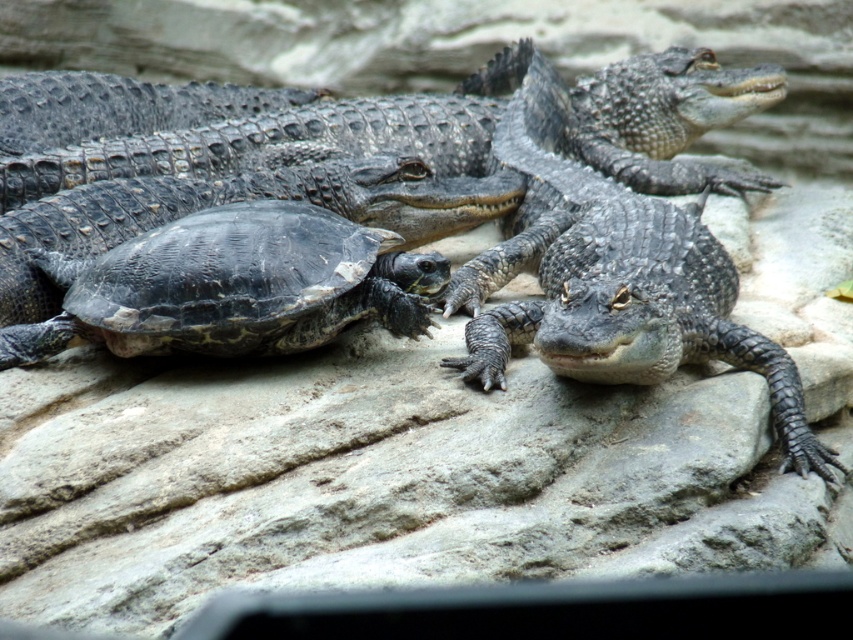
Can you confirm if shiny black alligator at center is taller than black textured shell at lower left?

Yes.

This screenshot has width=853, height=640. What do you see at coordinates (613, 284) in the screenshot? I see `shiny black alligator at center` at bounding box center [613, 284].

At what (x,y) coordinates should I click in order to perform the action: click on shiny black alligator at center. Please return your answer as a coordinate pair (x, y). This screenshot has height=640, width=853. Looking at the image, I should click on (613, 284).

Where is `shiny black alligator at center`? shiny black alligator at center is located at coordinates (613, 284).

Is shiny dark green crocodile at center above shiny black alligator at center?

Correct, shiny dark green crocodile at center is located above shiny black alligator at center.

Does shiny dark green crocodile at center have a larger size compared to shiny black alligator at center?

Correct, shiny dark green crocodile at center is larger in size than shiny black alligator at center.

I want to click on shiny dark green crocodile at center, so click(351, 150).

The image size is (853, 640). I want to click on shiny dark green crocodile at center, so click(351, 150).

Is shiny dark green crocodile at center thinner than black textured shell at lower left?

In fact, shiny dark green crocodile at center might be wider than black textured shell at lower left.

Does shiny dark green crocodile at center appear over black textured shell at lower left?

Indeed, shiny dark green crocodile at center is positioned over black textured shell at lower left.

This screenshot has height=640, width=853. What do you see at coordinates (351, 150) in the screenshot?
I see `shiny dark green crocodile at center` at bounding box center [351, 150].

Find the location of a particular element. shiny dark green crocodile at center is located at coordinates (351, 150).